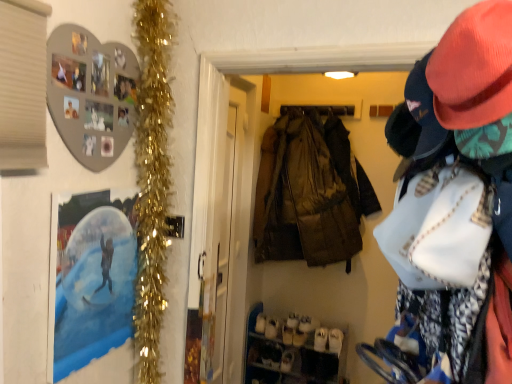
Question: Is white suede shoe at lower center, the 2th shoe in the right-to-left sequence, shorter than white suede shoe at lower center, which is the second shoe from left to right?

Choices:
 (A) yes
 (B) no

Answer: (A)

Question: Considering the relative sizes of white suede shoe at lower center, marked as the 1th shoe in a left-to-right arrangement, and white suede shoe at lower center, which is the second shoe from left to right, in the image provided, is white suede shoe at lower center, marked as the 1th shoe in a left-to-right arrangement, wider than white suede shoe at lower center, which is the second shoe from left to right,?

Choices:
 (A) no
 (B) yes

Answer: (A)

Question: Is white suede shoe at lower center, marked as the 1th shoe in a left-to-right arrangement, not close to white suede shoe at lower center, which is the second shoe from left to right?

Choices:
 (A) yes
 (B) no

Answer: (B)

Question: Considering the relative sizes of white suede shoe at lower center, the 2th shoe in the right-to-left sequence, and white suede shoe at lower center, which is the second shoe from left to right, in the image provided, is white suede shoe at lower center, the 2th shoe in the right-to-left sequence, thinner than white suede shoe at lower center, which is the second shoe from left to right,?

Choices:
 (A) no
 (B) yes

Answer: (B)

Question: Can you confirm if white suede shoe at lower center, marked as the 1th shoe in a left-to-right arrangement, is positioned to the left of white suede shoe at lower center, the first shoe viewed from the right?

Choices:
 (A) yes
 (B) no

Answer: (A)

Question: Can you confirm if white suede shoe at lower center, marked as the 1th shoe in a left-to-right arrangement, is positioned to the right of white suede shoe at lower center, the first shoe viewed from the right?

Choices:
 (A) yes
 (B) no

Answer: (B)

Question: Does transparent plastic screen door at center appear on the right side of white suede shoe at lower center, marked as the 1th shoe in a left-to-right arrangement?

Choices:
 (A) no
 (B) yes

Answer: (A)

Question: Is transparent plastic screen door at center positioned in front of white suede shoe at lower center, marked as the 1th shoe in a left-to-right arrangement?

Choices:
 (A) yes
 (B) no

Answer: (A)

Question: Is transparent plastic screen door at center facing towards white suede shoe at lower center, the 2th shoe in the right-to-left sequence?

Choices:
 (A) no
 (B) yes

Answer: (A)

Question: Is transparent plastic screen door at center positioned with its back to white suede shoe at lower center, marked as the 1th shoe in a left-to-right arrangement?

Choices:
 (A) yes
 (B) no

Answer: (B)

Question: From the image's perspective, would you say transparent plastic screen door at center is shown under white suede shoe at lower center, the 2th shoe in the right-to-left sequence?

Choices:
 (A) no
 (B) yes

Answer: (A)

Question: Does transparent plastic screen door at center have a greater width compared to white suede shoe at lower center, the 2th shoe in the right-to-left sequence?

Choices:
 (A) yes
 (B) no

Answer: (B)

Question: Is transparent plastic screen door at center in front of matte pink hat at upper right?

Choices:
 (A) no
 (B) yes

Answer: (A)